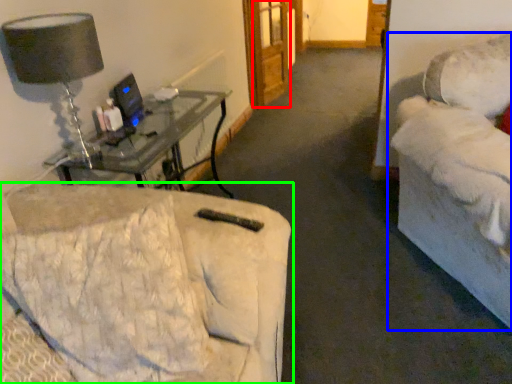
Question: Which is farther away from glass door (highlighted by a red box)? studio couch (highlighted by a blue box) or studio couch (highlighted by a green box)?

Choices:
 (A) studio couch
 (B) studio couch

Answer: (B)